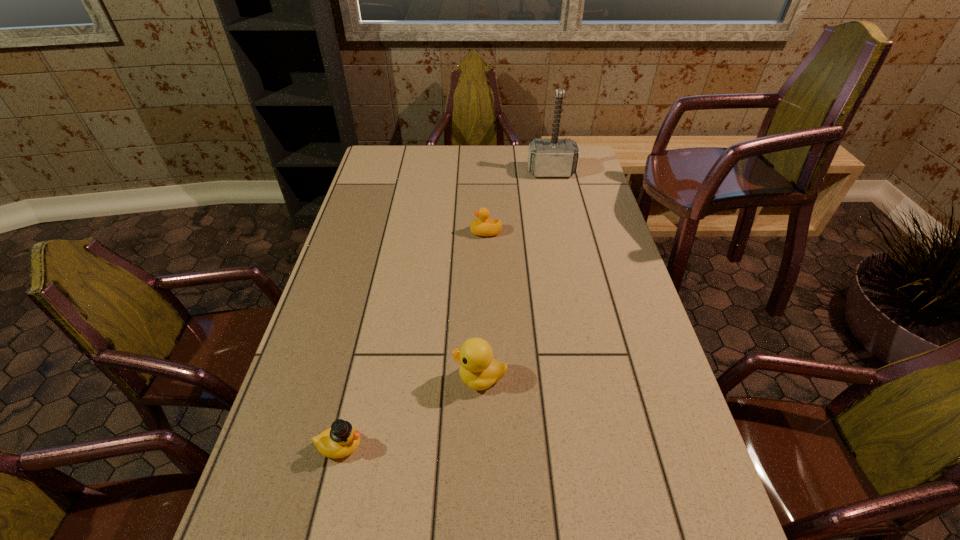
Identify the location of the rightmost object. (x=554, y=157).

Locate an element on the screen. This screenshot has height=540, width=960. the farthest object is located at coordinates (554, 157).

I want to click on the second farthest duck, so click(478, 369).

This screenshot has width=960, height=540. Find the location of `the third farthest object`. the third farthest object is located at coordinates (478, 369).

This screenshot has width=960, height=540. Find the location of `the farthest duck`. the farthest duck is located at coordinates (483, 225).

Where is `the leftmost duck`? The width and height of the screenshot is (960, 540). the leftmost duck is located at coordinates (340, 440).

Find the location of a particular element. the leftmost object is located at coordinates (340, 440).

This screenshot has width=960, height=540. In order to click on vacant space located 0.130m for striking with the head of the tallest object in this screenshot , I will do `click(557, 199)`.

At what (x,y) coordinates should I click in order to perform the action: click on vacant point located on the face of the second nearest object. Please return your answer as a coordinate pair (x, y). Looking at the image, I should click on (336, 377).

Locate an element on the screen. Image resolution: width=960 pixels, height=540 pixels. free location located 0.320m on the face of the second nearest object is located at coordinates (324, 377).